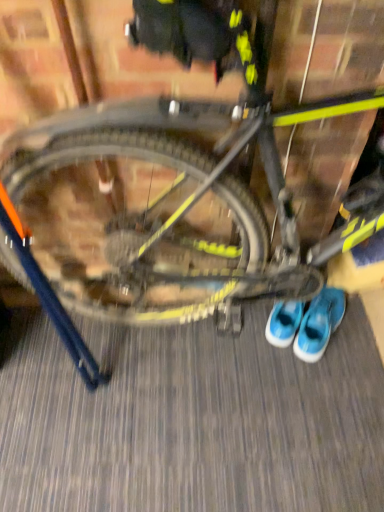
You are a GUI agent. You are given a task and a screenshot of the screen. Output one action in this format:
    pyautogui.click(x=<x>, y=<y>)
    Task: Click on the free location to the right of blue suede sneakers at lower right
    Image resolution: width=384 pixels, height=512 pixels.
    Given the screenshot: What is the action you would take?
    pyautogui.click(x=352, y=325)